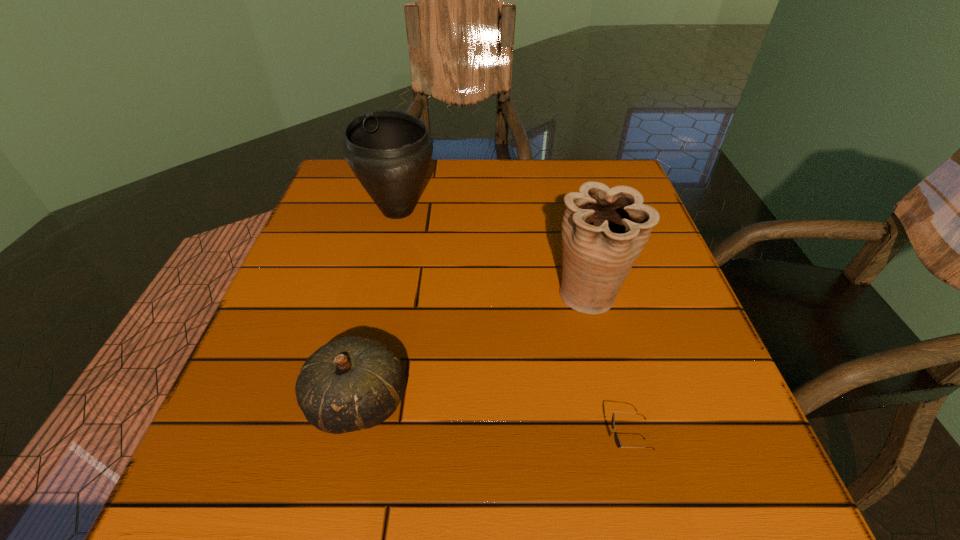
Identify the location of the farthest object. (389, 151).

Where is `the farther urn`? Image resolution: width=960 pixels, height=540 pixels. the farther urn is located at coordinates (389, 151).

The image size is (960, 540). I want to click on the second farthest object, so click(604, 230).

Locate an element on the screen. The image size is (960, 540). the nearer urn is located at coordinates (604, 230).

At what (x,y) coordinates should I click in order to perform the action: click on gourd. Please return your answer as a coordinate pair (x, y). Image resolution: width=960 pixels, height=540 pixels. Looking at the image, I should click on (352, 383).

The width and height of the screenshot is (960, 540). I want to click on the shortest object, so 618,443.

Identify the location of blank space located 0.220m on the right of the left urn. (526, 210).

Where is `vacant space located 0.300m on the left of the nearer urn`? vacant space located 0.300m on the left of the nearer urn is located at coordinates (402, 296).

The image size is (960, 540). I want to click on vacant area located 0.220m on the back of the gourd, so click(387, 274).

Identify the location of vacant area situated 0.240m in front of the lenses of the shortest object. This screenshot has height=540, width=960. (446, 445).